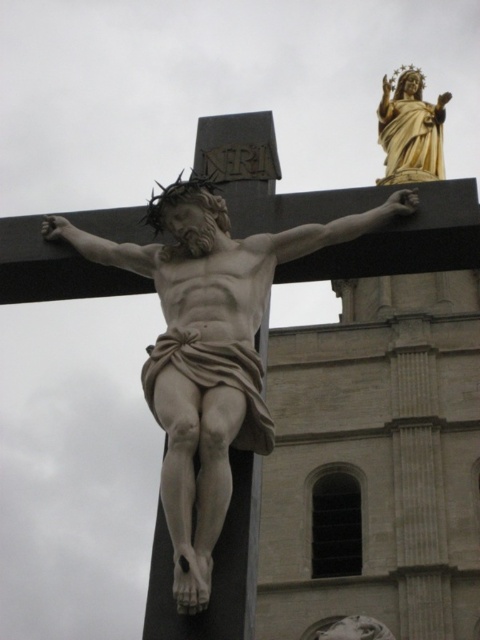
You are an art student analyzing the religious artwork. You observe the gold polished statue at upper right and the smooth white statue at center. Which statue is bigger in size?

The gold polished statue at upper right is larger in size compared to the smooth white statue at center.

You are an art student standing in front of the religious scene. You want to sketch both the white marble statue at center and the gold polished statue at upper right. Which statue should you focus on first if you want to draw the one closer to you?

The white marble statue at center is closer to the viewer than the gold polished statue at upper right, so you should focus on sketching the white marble statue at center first.

You are an art curator planning to display the white marble statue at center and the gold polished statue at upper right in a new exhibition. If you want to place them side by side, which statue should be positioned first to accommodate their widths?

The white marble statue at center should be positioned first since it is wider than the gold polished statue at upper right.